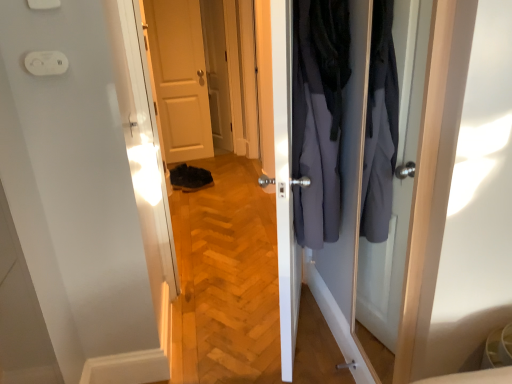
You are a GUI agent. You are given a task and a screenshot of the screen. Output one action in this format:
    pyautogui.click(x=<x>, y=<y>)
    Task: Click on the vacant region below black suede shoe at lower center (from a real-world perspective)
    
    Given the screenshot: What is the action you would take?
    pyautogui.click(x=188, y=181)